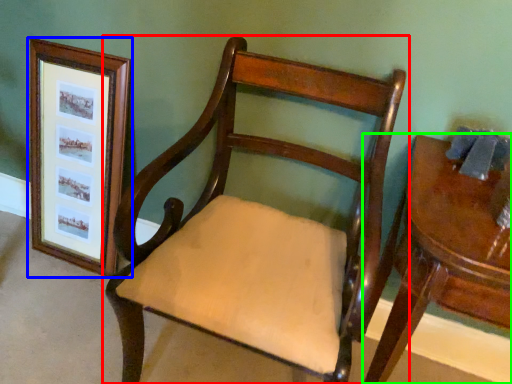
Question: Which object is positioned farthest from chair (highlighted by a red box)? Select from picture frame (highlighted by a blue box) and table (highlighted by a green box).

Choices:
 (A) picture frame
 (B) table

Answer: (A)